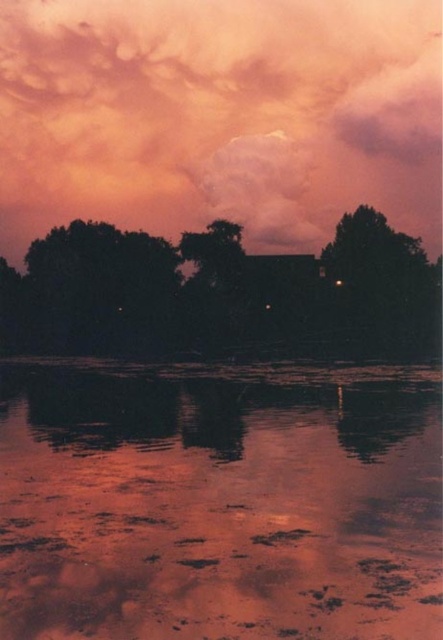
You are an architect designing a new eco friendly building. You want to ensure the building doesn not block the view of the cloudy sky at upper center from the silhouette leafy tree at center. Based on the scene description, which object is wider and therefore might require more consideration in the design to maintain the view?

The cloudy sky at upper center is wider than the silhouette leafy tree at center, so the building design should prioritize not obstructing the wider cloudy sky at upper center to preserve the view.

You are an artist trying to paint the evening scene. You need to decide the placement of the cloudy sky at upper center and the silhouette leafy tree at center. Based on their sizes, which one should be drawn higher on the canvas?

The cloudy sky at upper center should be drawn higher on the canvas because it has a greater height compared to the silhouette leafy tree at center.